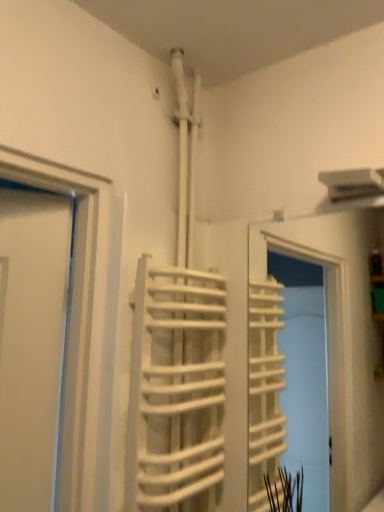
This screenshot has height=512, width=384. Describe the element at coordinates (285, 490) in the screenshot. I see `green matte plant at lower right` at that location.

Identify the location of green matte plant at lower right. This screenshot has width=384, height=512. (285, 490).

In order to face white matte stair at center, should I rotate leftwards or rightwards?

Rotate left and turn 0.091 degrees.

This screenshot has width=384, height=512. Describe the element at coordinates (176, 390) in the screenshot. I see `white matte stair at center` at that location.

The image size is (384, 512). What are the coordinates of `white matte stair at center` in the screenshot? It's located at (176, 390).

The height and width of the screenshot is (512, 384). I want to click on green matte plant at lower right, so click(x=285, y=490).

Is green matte plant at lower right to the left of white matte stair at center from the viewer's perspective?

In fact, green matte plant at lower right is to the right of white matte stair at center.

Is green matte plant at lower right positioned behind white matte stair at center?

That is True.

Which is nearer, [288,499] or [128,504]?

Point [288,499].

From the image's perspective, is green matte plant at lower right above or below white matte stair at center?

Clearly, from the image's perspective, green matte plant at lower right is below white matte stair at center.

From a real-world perspective, is green matte plant at lower right positioned over white matte stair at center based on gravity?

Incorrect, from a real-world perspective, green matte plant at lower right is lower than white matte stair at center.

Can you confirm if green matte plant at lower right is wider than white matte stair at center?

Incorrect, the width of green matte plant at lower right does not surpass that of white matte stair at center.

Is green matte plant at lower right shorter than white matte stair at center?

Yes.

Considering the sizes of objects green matte plant at lower right and white matte stair at center in the image provided, who is smaller, green matte plant at lower right or white matte stair at center?

green matte plant at lower right.

Is green matte plant at lower right not inside white matte stair at center?

Yes, green matte plant at lower right is not within white matte stair at center.

Is there a large distance between green matte plant at lower right and white matte stair at center?

They are positioned close to each other.

Is green matte plant at lower right aimed at white matte stair at center?

No, green matte plant at lower right is not aimed at white matte stair at center.

Find the location of `stair that is in front of the green matte plant at lower right`. stair that is in front of the green matte plant at lower right is located at coordinates pyautogui.click(x=176, y=390).

Which is more to the right, white matte stair at center or green matte plant at lower right?

green matte plant at lower right.

Between white matte stair at center and green matte plant at lower right, which one is positioned in front?

white matte stair at center is more forward.

Which point is more forward, [132,483] or [298,504]?

Positioned in front is point [132,483].

From the image's perspective, who appears lower, white matte stair at center or green matte plant at lower right?

green matte plant at lower right.

From a real-world perspective, which object rests below the other?

In real-world perspective, green matte plant at lower right is lower.

Considering the sizes of objects white matte stair at center and green matte plant at lower right in the image provided, who is wider, white matte stair at center or green matte plant at lower right?

Wider between the two is white matte stair at center.

Does white matte stair at center have a greater height compared to green matte plant at lower right?

Correct, white matte stair at center is much taller as green matte plant at lower right.

Considering the sizes of objects white matte stair at center and green matte plant at lower right in the image provided, who is bigger, white matte stair at center or green matte plant at lower right?

Bigger between the two is white matte stair at center.

Is white matte stair at center located outside green matte plant at lower right?

Result: Indeed, white matte stair at center is completely outside green matte plant at lower right.

Is white matte stair at center next to green matte plant at lower right and touching it?

They are not placed beside each other.

Does white matte stair at center turn towards green matte plant at lower right?

Yes, white matte stair at center is facing green matte plant at lower right.

Identify the location of stair on the left side of green matte plant at lower right. This screenshot has height=512, width=384. (176, 390).

At what (x,y) coordinates should I click in order to perform the action: click on plant that appears behind the white matte stair at center. Please return your answer as a coordinate pair (x, y). This screenshot has width=384, height=512. Looking at the image, I should click on (285, 490).

Identify the location of stair above the green matte plant at lower right (from a real-world perspective). The image size is (384, 512). (176, 390).